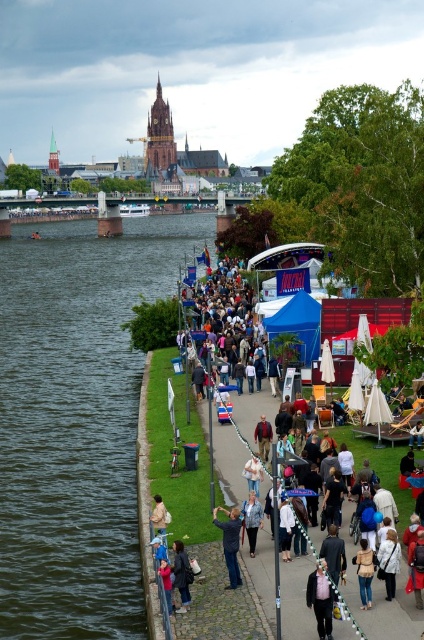
Question: Which point is farther to the camera?

Choices:
 (A) (251, 534)
 (B) (176, 552)

Answer: (A)

Question: Is dark blue jeans at lower center positioned at the back of denim jacket at center?

Choices:
 (A) no
 (B) yes

Answer: (A)

Question: Which of the following is the closest to the observer?

Choices:
 (A) (250, 508)
 (B) (189, 573)
 (C) (49, 545)

Answer: (B)

Question: Is matte black jacket at center above light brown leather jacket at lower center?

Choices:
 (A) no
 (B) yes

Answer: (A)

Question: Does matte black jacket at center appear over dark blue jeans at center?

Choices:
 (A) no
 (B) yes

Answer: (A)

Question: Which of the following is the closest to the observer?

Choices:
 (A) coord(362,584)
 (B) coord(183,557)

Answer: (A)